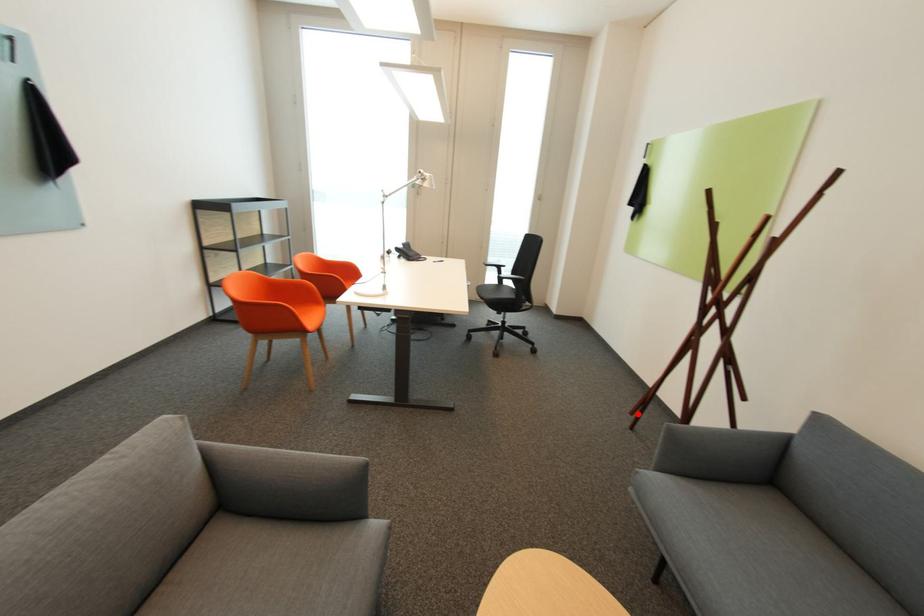
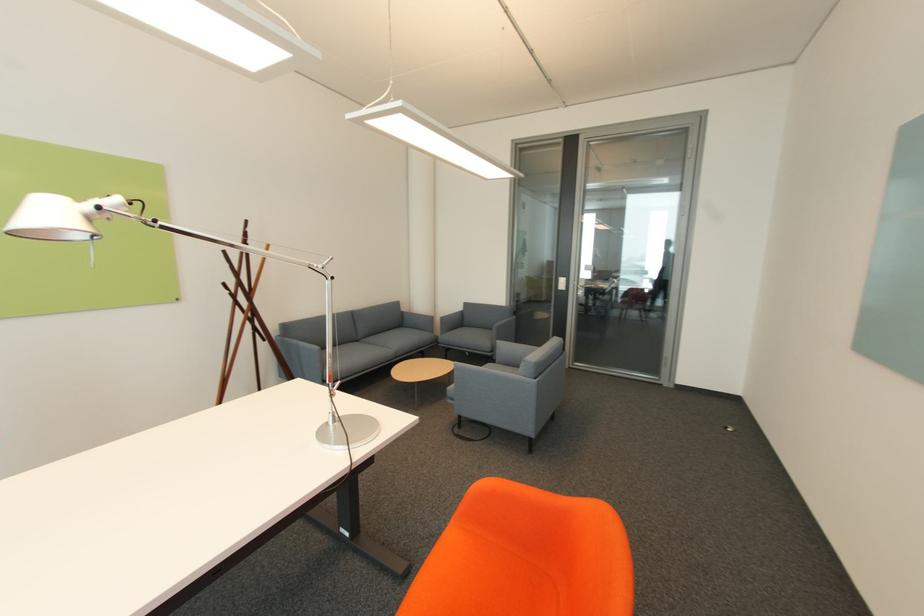
Question: I am providing you with two images of the same scene from different viewpoints. A red point is marked on the first image. Is the red point's position out of view in image 2?

Choices:
 (A) Yes
 (B) No

Answer: (A)